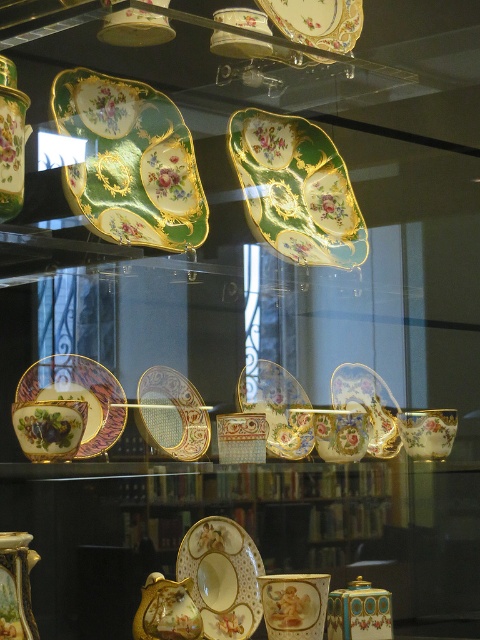
Question: Can you confirm if matte gold plate at center is smaller than gold-gilded porcelain plate at center?

Choices:
 (A) yes
 (B) no

Answer: (A)

Question: Estimate the real-world distances between objects in this image. Which object is closer to the porcelain vase at lower left?

Choices:
 (A) gold-gilded porcelain plate at lower left
 (B) porcelain plate at center

Answer: (A)

Question: Considering the real-world distances, which object is farthest from the gold-gilded porcelain plate at lower left?

Choices:
 (A) porcelain vase at center
 (B) matte gold plate at center
 (C) porcelain plate at center

Answer: (A)

Question: Which point appears closest to the camera in this image?

Choices:
 (A) (386, 406)
 (B) (305, 442)
 (C) (86, 211)
 (D) (156, 579)

Answer: (C)

Question: Does porcelain plate at center have a lesser width compared to porcelain vase at lower left?

Choices:
 (A) no
 (B) yes

Answer: (A)

Question: Is gold-gilded porcelain plate at lower left positioned in front of porcelain vase at lower left?

Choices:
 (A) no
 (B) yes

Answer: (A)